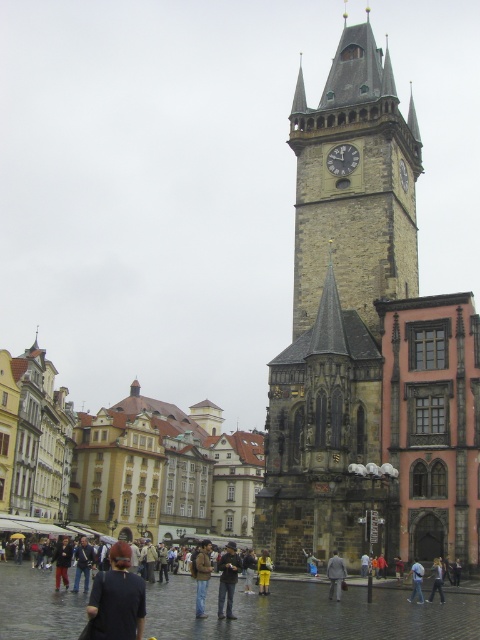
Question: Is light gray suit at center to the left of light blue jeans at center from the viewer's perspective?

Choices:
 (A) yes
 (B) no

Answer: (A)

Question: Does stone clock tower at center lie in front of light blue jeans at center?

Choices:
 (A) no
 (B) yes

Answer: (A)

Question: Which of the following is the closest to the observer?

Choices:
 (A) (66, 568)
 (B) (389, 70)
 (C) (90, 630)

Answer: (C)

Question: Does stone clock tower at right come in front of denim pants at center?

Choices:
 (A) yes
 (B) no

Answer: (A)

Question: Which point is closer to the camera?

Choices:
 (A) light brown leather jacket at center
 (B) denim jeans at center

Answer: (B)

Question: Which object appears closest to the camera in this image?

Choices:
 (A) light gray suit at center
 (B) dark brown leather jacket at lower left

Answer: (B)